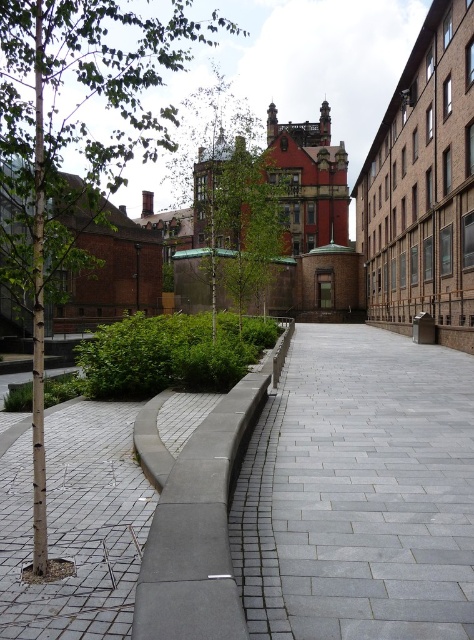
You are a delivery person carrying a box that is 1.2 meters wide. You need to navigate through the gray concrete alley at center and the concrete at center. Which path can your box fit through?

The gray concrete alley at center has a width larger than the concrete at center. Since your box is 1.2 meters wide, you should choose the gray concrete alley at center as it is wider and can accommodate the box.

You are a delivery person trying to navigate through the gray concrete alley at center and the concrete at center. Which path has a lower height that might be easier for your delivery cart to pass through?

The gray concrete alley at center has a lesser height compared to the concrete at center, so it would be easier for the delivery cart to pass through.